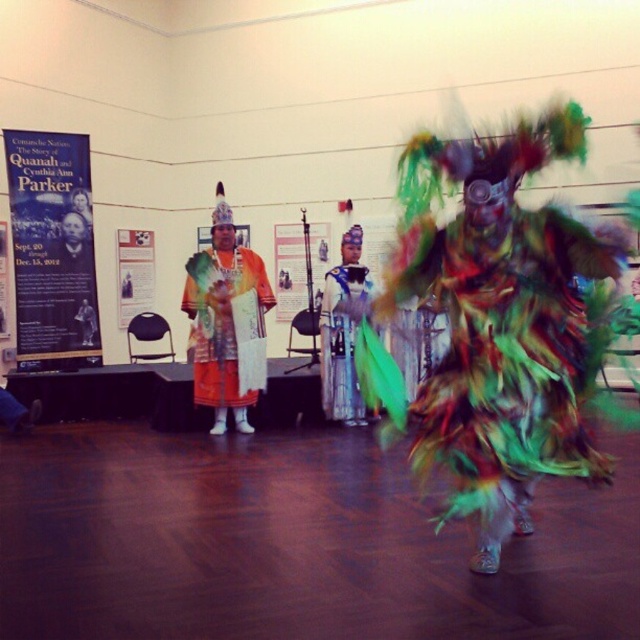
You are an event organizer who needs to hang a new banner that is 1.2 meters tall. Looking at the scene, can the new banner fit vertically between the matte orange fabric at center and the white paper poster at center without overlapping either?

The matte orange fabric at center is much taller than the white paper poster at center. Since the new banner is 1.2 meters tall, it can fit vertically between them as long as there is enough space between their heights. However, without knowing the exact heights of both objects, it is impossible to confirm if the banner will fit precisely.

You are an event photographer who needs to capture a photo of the matte orange fabric at center and the white paper poster at center. From your current position, which object is positioned to the right?

The matte orange fabric at center is positioned to the right of the white paper poster at center.